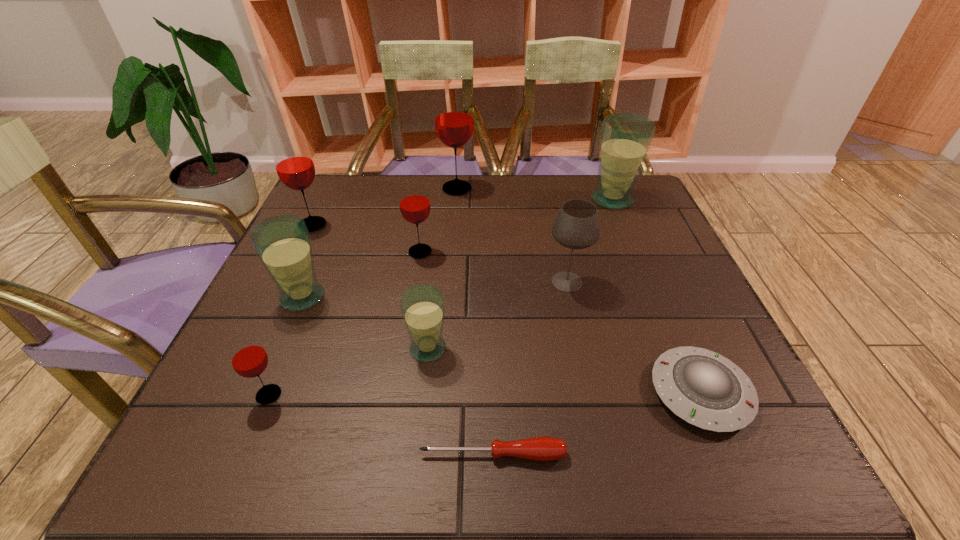
Identify the location of screwdriver present at the near edge. Image resolution: width=960 pixels, height=540 pixels. tap(538, 448).

Find the location of a particular element. This screenshot has height=540, width=960. glass positioned at the right edge is located at coordinates (625, 138).

You are a GUI agent. You are given a task and a screenshot of the screen. Output one action in this format:
    pyautogui.click(x=<x>, y=<y>)
    Task: Click on the saucer that is at the right edge
    Image resolution: width=960 pixels, height=540 pixels.
    Given the screenshot: What is the action you would take?
    pyautogui.click(x=705, y=389)

Locate an element on the screen. The height and width of the screenshot is (540, 960). object at the far left corner is located at coordinates (294, 165).

This screenshot has height=540, width=960. In order to click on object at the far right corner in this screenshot , I will do `click(625, 138)`.

Where is `object situated at the near right corner`? object situated at the near right corner is located at coordinates [x=705, y=389].

At what (x,y) coordinates should I click in order to perform the action: click on blank area at the far edge. Please return your answer as a coordinate pair (x, y). Looking at the image, I should click on (481, 204).

This screenshot has height=540, width=960. In the image, there is a desktop. What are the coordinates of `vacant space at the near edge` in the screenshot? It's located at (348, 451).

Image resolution: width=960 pixels, height=540 pixels. In order to click on vacant space at the left edge in this screenshot , I will do `click(346, 243)`.

In the image, there is a desktop. Identify the location of blank space at the right edge. (601, 224).